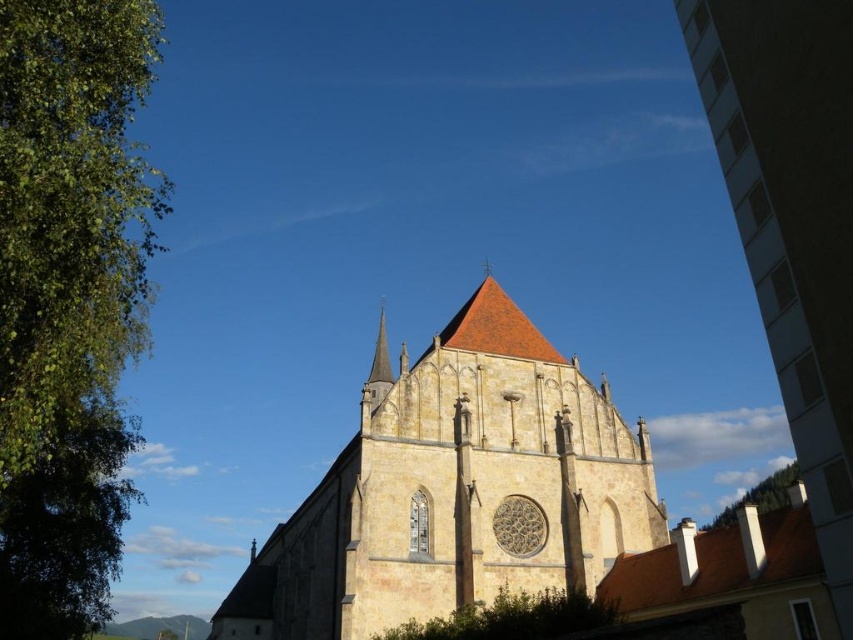
Question: Estimate the real-world distances between objects in this image. Which object is farther from the green leafy tree at left?

Choices:
 (A) white concrete building at right
 (B) green leafy tree at upper left

Answer: (B)

Question: Does green leafy tree at lower center appear over green leafy tree at upper left?

Choices:
 (A) no
 (B) yes

Answer: (B)

Question: Which of the following is the farthest from the observer?

Choices:
 (A) green leafy tree at left
 (B) green leafy tree at upper left
 (C) green leafy tree at lower center

Answer: (B)

Question: Which object is farther from the camera taking this photo?

Choices:
 (A) green leafy tree at left
 (B) green leafy tree at lower center
 (C) white concrete building at right
 (D) smooth gold spire at center

Answer: (D)

Question: Where is green leafy tree at left located in relation to white concrete building at right in the image?

Choices:
 (A) right
 (B) left

Answer: (B)

Question: Does green leafy tree at left lie behind smooth gold spire at center?

Choices:
 (A) yes
 (B) no

Answer: (B)